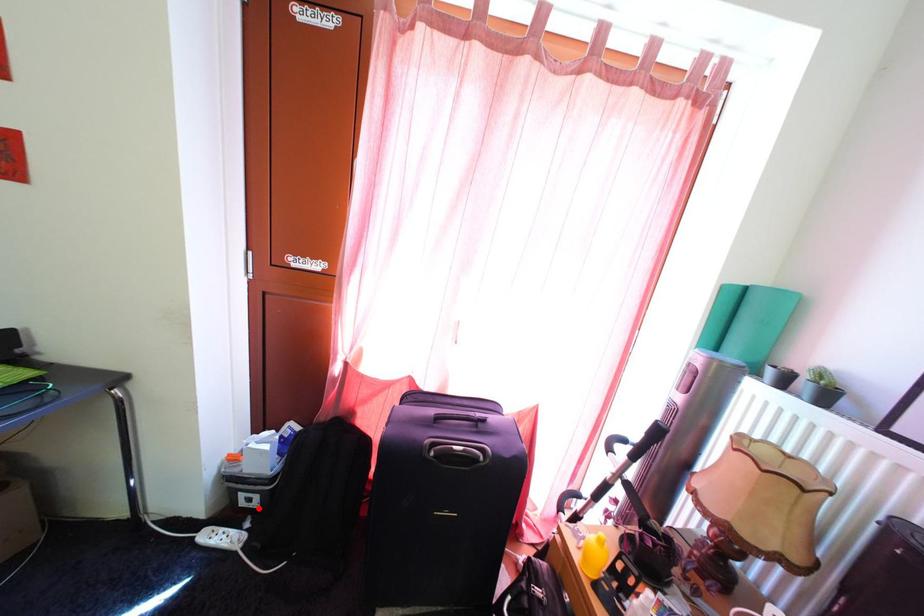
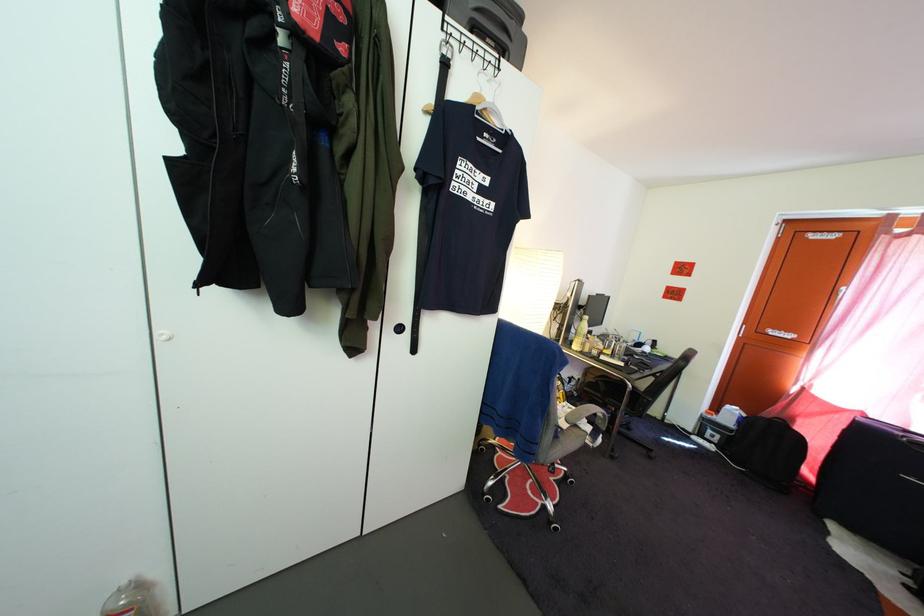
Locate, in the second image, the point that corresponds to the highlighted location in the first image.

(721, 445)